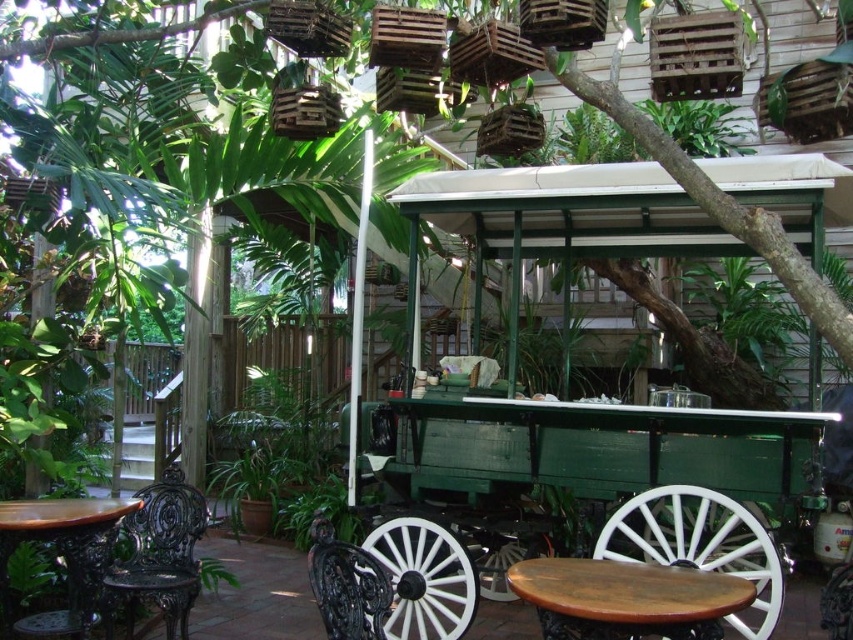
You are planning to place a small potted plant between the black wrought iron chair at lower left and the wooden table at lower left. Based on their positions, where should the plant be placed relative to the chair and table?

The black wrought iron chair at lower left is located below the wooden table at lower left, so the plant should be placed between them in the space between the chair and the table.

You are a caterer setting up for an event and need to move a 36 inch wide tablecloth between the green wooden wagon at center and the wooden table at center. Can the tablecloth fit between them without folding?

The green wooden wagon at center and wooden table at center are 32.87 inches apart from each other. Since the tablecloth is 36 inches wide, it is wider than the space between them, so it cannot fit without folding.

You are planning to place a rectangular tray that is 1 meter wide on the black wrought iron chair at lower left and the wooden table at lower left. Which object can accommodate the tray without it overhanging?

The wooden table at lower left can accommodate the tray since the black wrought iron chair at lower left has a lesser width compared to wooden table at lower left, meaning the table is wider and can fit the 1 meter wide tray without overhanging.